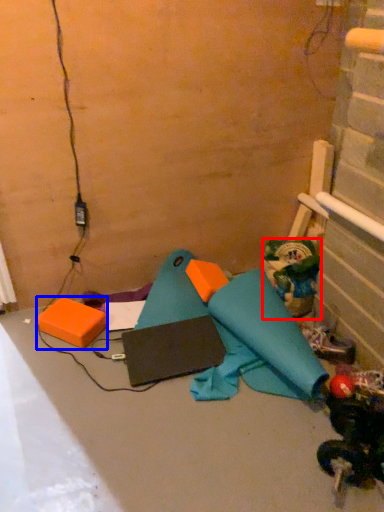
Question: Which object is closer to the camera taking this photo, toy (highlighted by a red box) or box (highlighted by a blue box)?

Choices:
 (A) toy
 (B) box

Answer: (B)